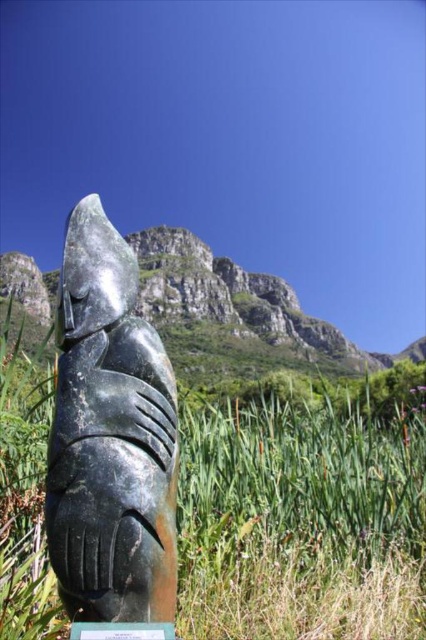
You are a landscape architect planning to place a new statue in this outdoor area. The statue will be placed between the green grass at center and the green stone plaque at center. Which object will the statue be closer to, and why?

The statue will be closer to the green grass at center because its width surpasses that of the green stone plaque at center, meaning there is more space available next to the grass.

You are an art student analyzing the sculpture arrangement in the image. You notice the black polished stone totem at center and the green stone plaque at center. Which object is positioned to the left side?

The black polished stone totem at center is positioned to the left of the green stone plaque at center.